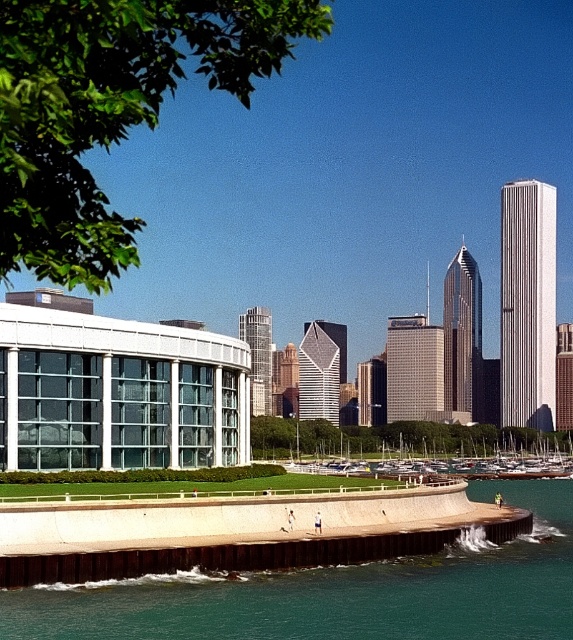
Does teal concrete wall at lower center have a larger size compared to white wooden boats at center?

Incorrect, teal concrete wall at lower center is not larger than white wooden boats at center.

Does point (352, 625) come behind point (413, 435)?

No, (352, 625) is in front of (413, 435).

Image resolution: width=573 pixels, height=640 pixels. Find the location of `teal concrete wall at lower center`. teal concrete wall at lower center is located at coordinates (339, 593).